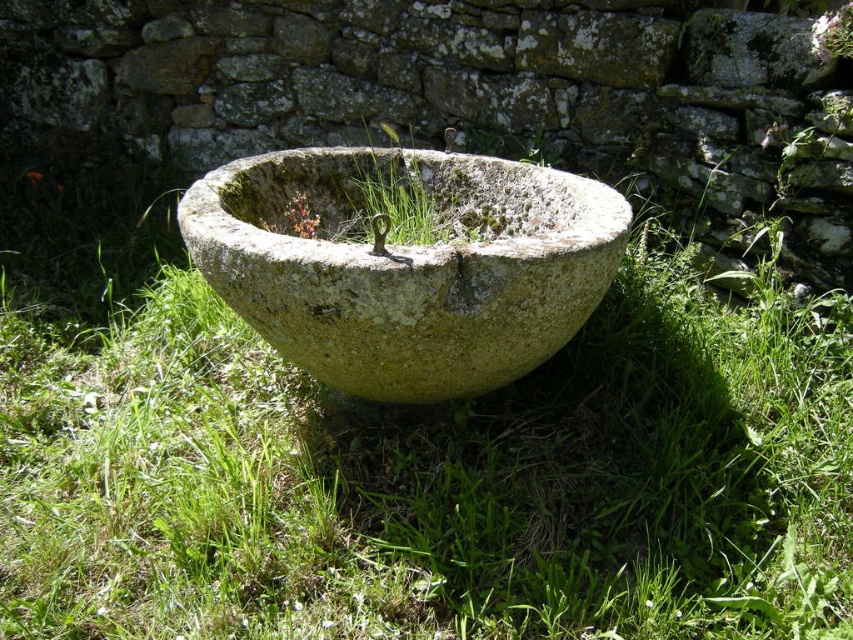
Question: Does green mossy stone bowl at center appear under green mossy stone at center?

Choices:
 (A) yes
 (B) no

Answer: (A)

Question: Among these points, which one is nearest to the camera?

Choices:
 (A) (434, 202)
 (B) (248, 296)

Answer: (B)

Question: Does green mossy stone bowl at center appear over green mossy stone at center?

Choices:
 (A) no
 (B) yes

Answer: (A)

Question: Can you confirm if green mossy stone bowl at center is positioned above green mossy stone at center?

Choices:
 (A) yes
 (B) no

Answer: (B)